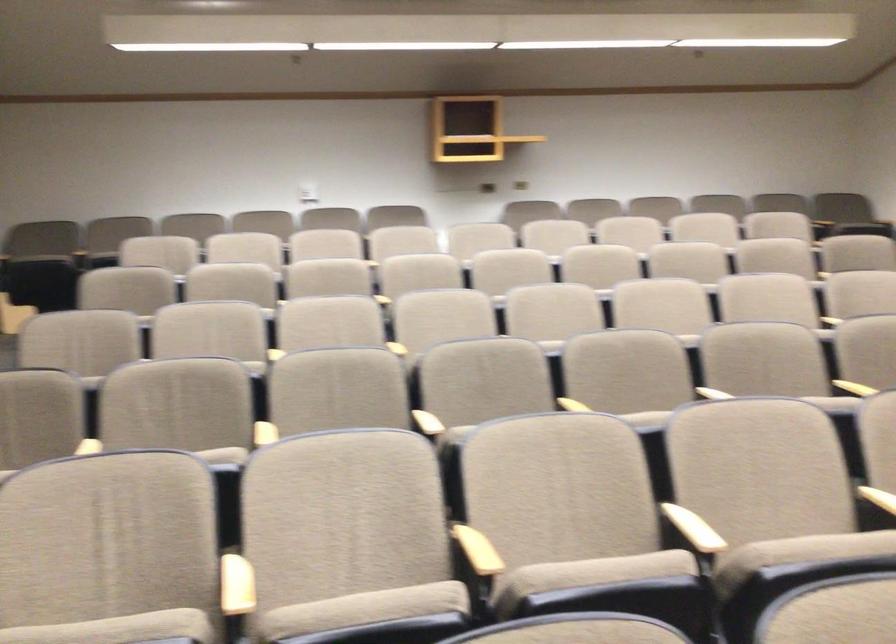
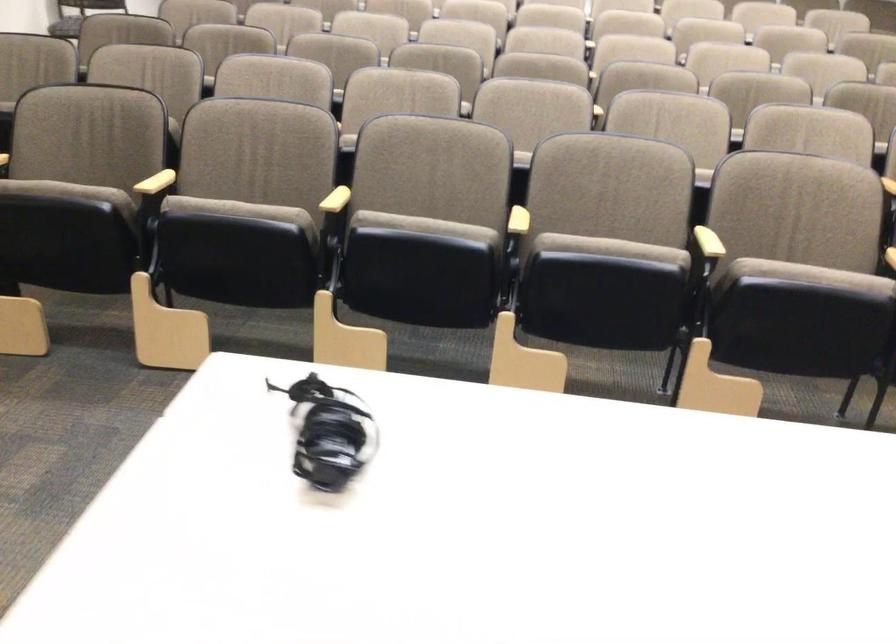
Question: I am providing you with two images of the same scene from different viewpoints. Please identify which objects are invisible in image2.

Choices:
 (A) wooden pen holder
 (B) beige chair sitting surface
 (C) chair sitting surface
 (D) wooden chair armrest

Answer: (B)